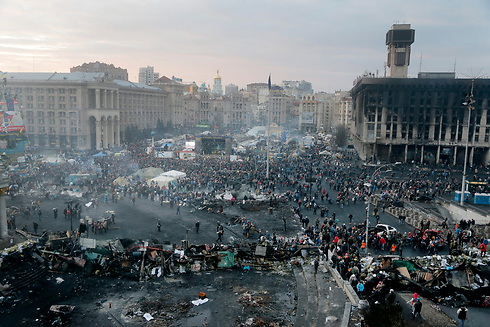
At what (x,y) coordinates should I click in order to perform the action: click on columns. Please return your answer as a coordinate pair (x, y). Looking at the image, I should click on (97, 101), (104, 100), (108, 99), (115, 101), (118, 126), (109, 131), (100, 133).